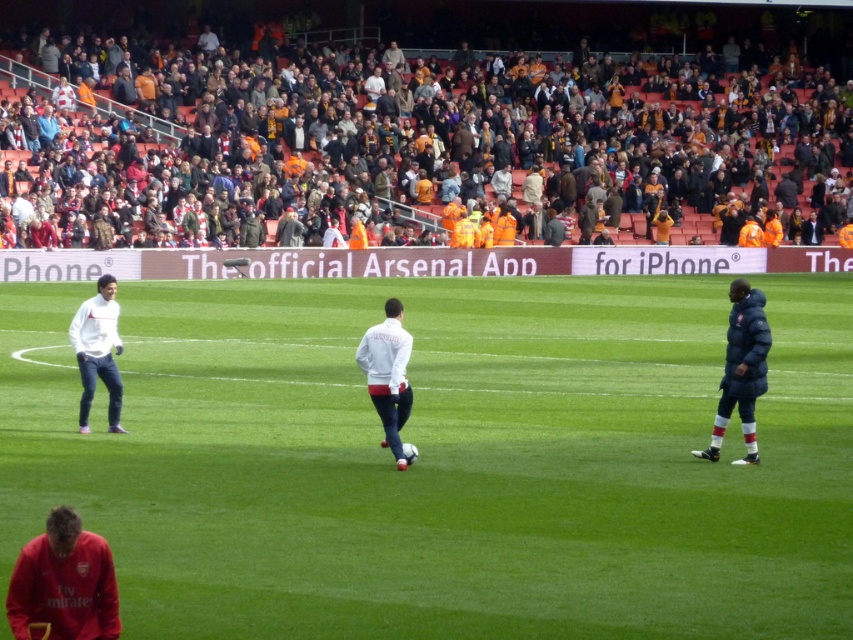
Question: Which of the following is the farthest from the observer?

Choices:
 (A) (744, 525)
 (B) (82, 387)
 (C) (776, 193)

Answer: (C)

Question: Which point is farther from the camera taking this photo?

Choices:
 (A) (837, 392)
 (B) (264, 196)

Answer: (B)

Question: Which object is farther from the camera taking this photo?

Choices:
 (A) green grass at center
 (B) white matte jacket at left
 (C) brown leather seats at upper center

Answer: (C)

Question: From the image, what is the correct spatial relationship of green grass at center in relation to white matte jacket at left?

Choices:
 (A) below
 (B) above

Answer: (A)

Question: Does green grass at center have a smaller size compared to brown leather seats at upper center?

Choices:
 (A) no
 (B) yes

Answer: (B)

Question: Does green grass at center appear on the right side of brown leather seats at upper center?

Choices:
 (A) yes
 (B) no

Answer: (B)